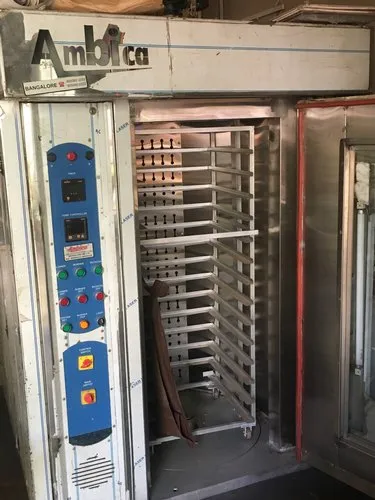
Image resolution: width=375 pixels, height=500 pixels. What are the coordinates of `door` in the screenshot? It's located at (328, 332).